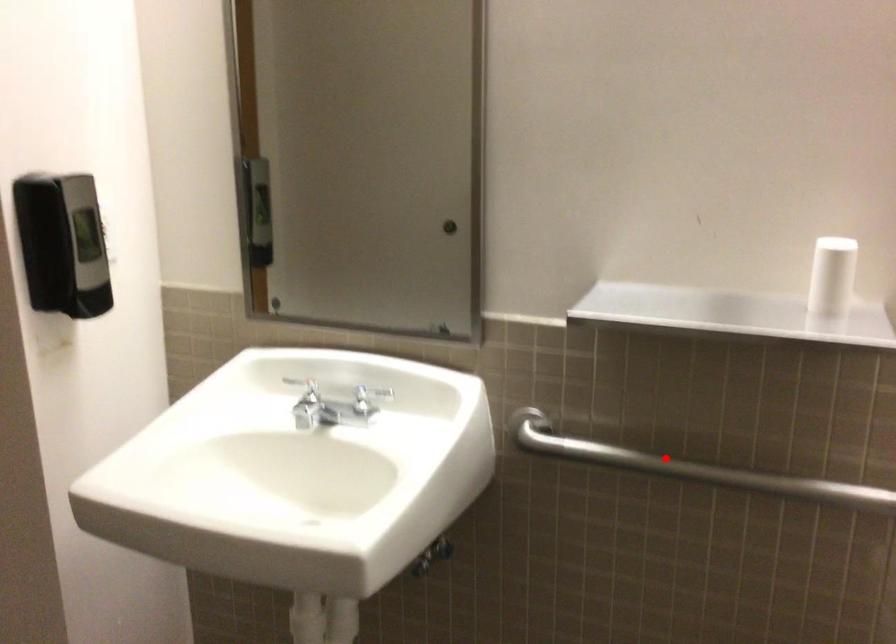
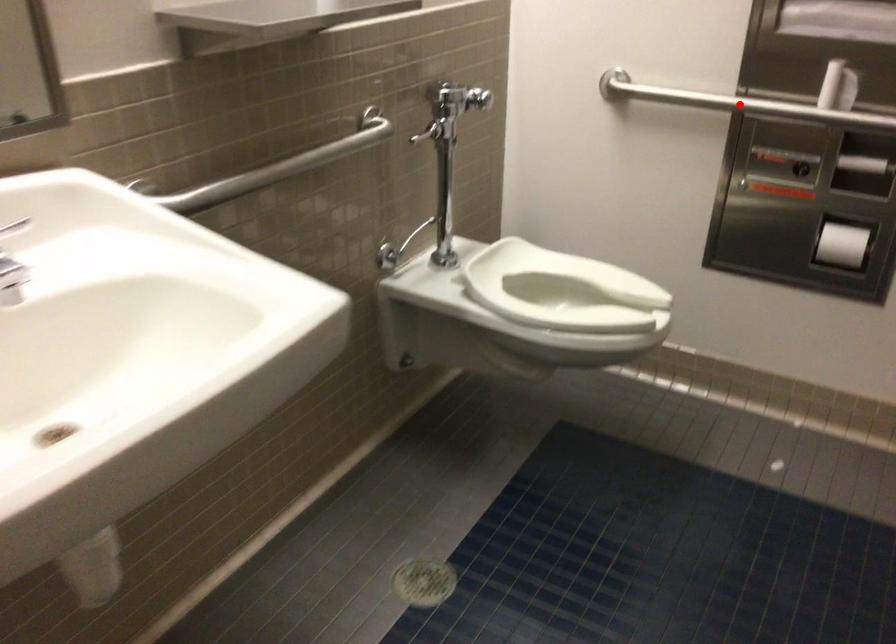
I am providing you with two images of the same scene from different viewpoints. A red point is marked on the first image and another point is marked on the second image. Are the points marked in image1 and image2 representing the same 3D position?

No